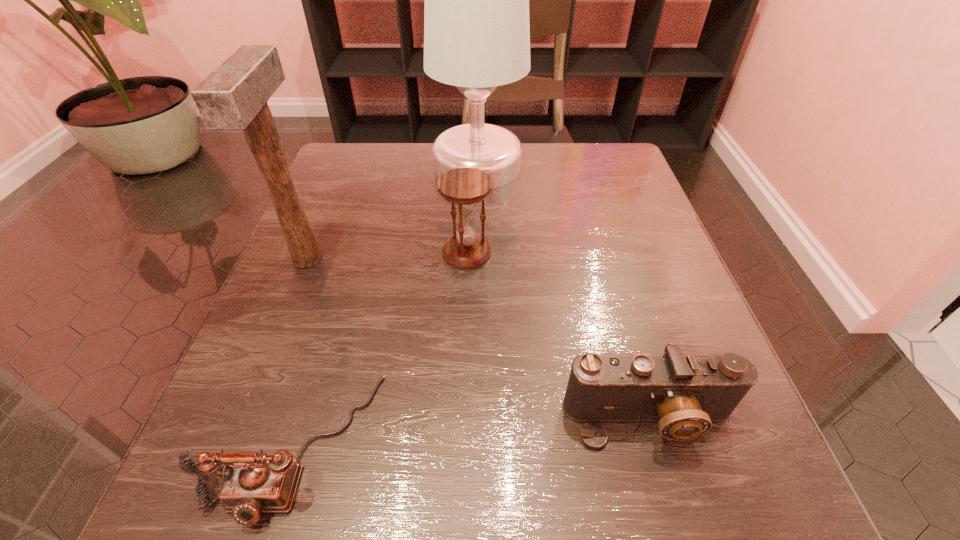
This screenshot has height=540, width=960. In order to click on vacant space located 0.090m on the front-facing side of the rightmost object in this screenshot , I will do click(681, 531).

You are a GUI agent. You are given a task and a screenshot of the screen. Output one action in this format:
    pyautogui.click(x=<x>, y=<y>)
    Task: Click on the object at the far edge
    The width and height of the screenshot is (960, 540).
    Given the screenshot: What is the action you would take?
    pyautogui.click(x=476, y=16)

Find the location of a particular element. object at the near edge is located at coordinates pyautogui.click(x=254, y=483).

Where is `mallet that is at the left edge`? Image resolution: width=960 pixels, height=540 pixels. mallet that is at the left edge is located at coordinates (234, 96).

In order to click on telephone that is at the left edge in this screenshot , I will do `click(254, 483)`.

The image size is (960, 540). Identify the location of object present at the right edge. (684, 393).

This screenshot has height=540, width=960. In order to click on object at the near left corner in this screenshot , I will do `click(254, 483)`.

You are a GUI agent. You are given a task and a screenshot of the screen. Output one action in this format:
    pyautogui.click(x=<x>, y=<y>)
    Task: Click on the vacant space at the far edge
    
    Given the screenshot: What is the action you would take?
    pyautogui.click(x=432, y=181)

Locate an element on the screen. This screenshot has width=960, height=540. vacant space at the near edge is located at coordinates (408, 462).

Image resolution: width=960 pixels, height=540 pixels. In order to click on vacant space at the right edge of the desktop in this screenshot , I will do `click(651, 241)`.